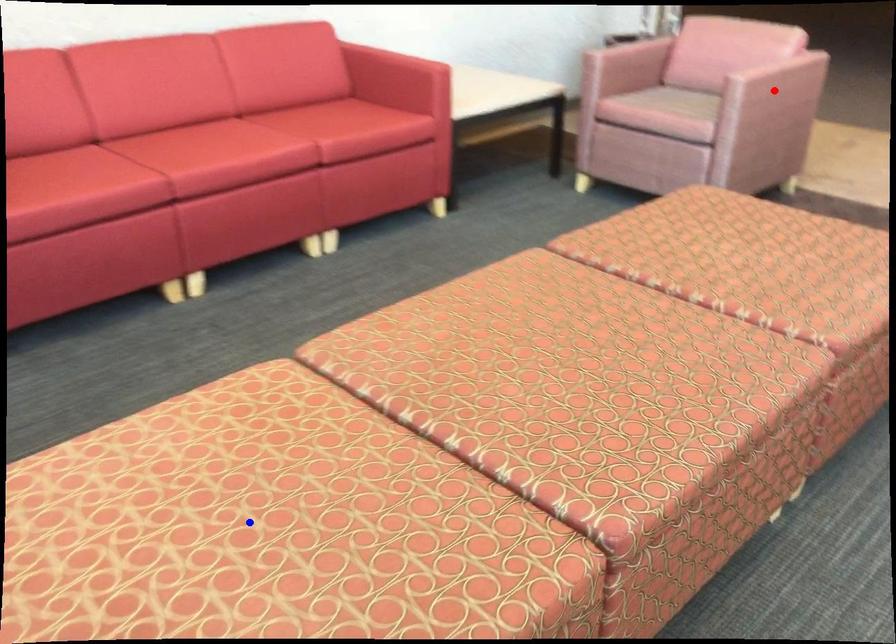
Question: In the image, two points are highlighted. Which point is nearer to the camera? Reply with the corresponding letter.

Choices:
 (A) blue point
 (B) red point

Answer: (A)